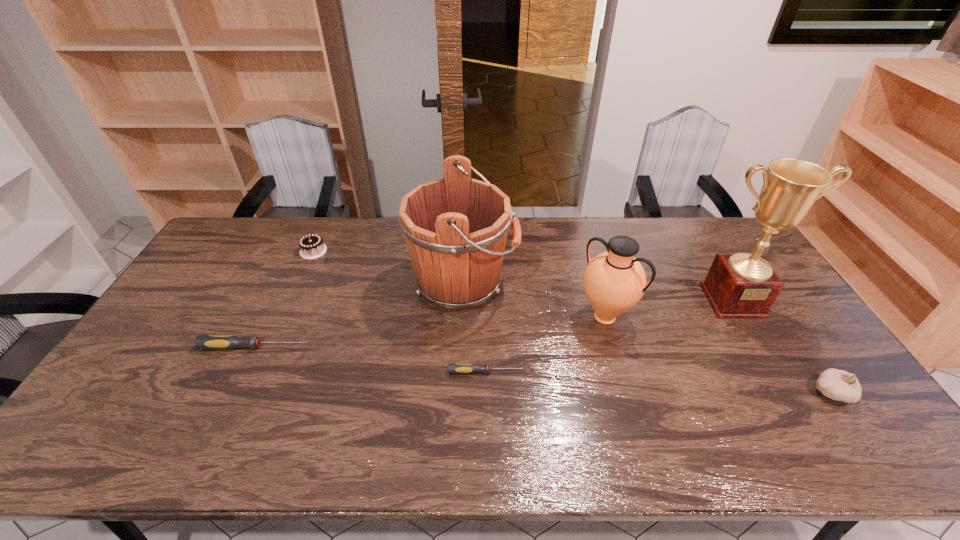
Where is `the farther screwdriver`? This screenshot has height=540, width=960. the farther screwdriver is located at coordinates (202, 342).

Locate an element on the screen. the fifth farthest object is located at coordinates (202, 342).

I want to click on the nearer screwdriver, so click(453, 368).

Find the location of `the right screwdriver`. the right screwdriver is located at coordinates (453, 368).

Find the location of a particular element. The image size is (960, 540). the sixth shortest object is located at coordinates (455, 228).

In order to click on chocolate cake in this screenshot , I will do `click(311, 246)`.

The width and height of the screenshot is (960, 540). I want to click on the third object from right to left, so click(x=614, y=281).

Find the location of `pitcher`. pitcher is located at coordinates (614, 281).

Identify the location of trophy cup. (738, 286).

Locate an element on the screen. The width and height of the screenshot is (960, 540). garlic is located at coordinates (838, 385).